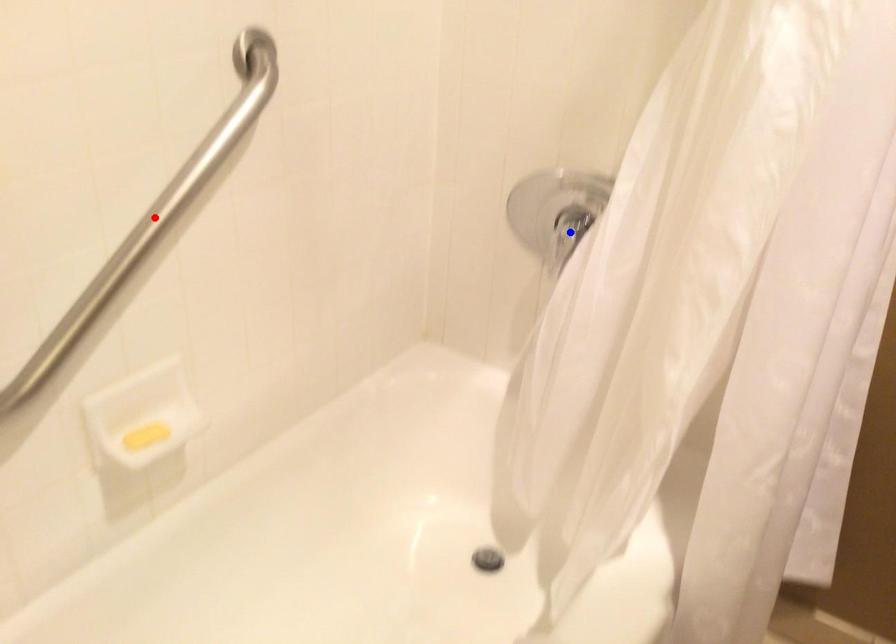
Question: Which of the two points in the image is closer to the camera?

Choices:
 (A) Blue point is closer.
 (B) Red point is closer.

Answer: (B)